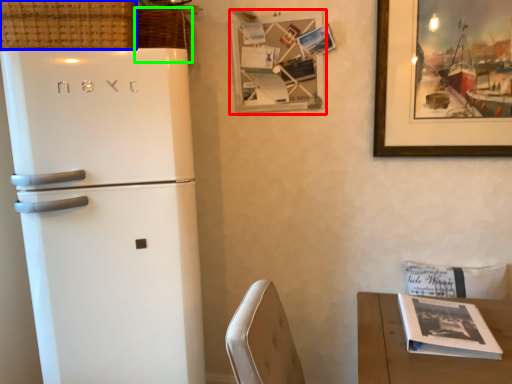
Question: Which object is the farthest from picture frame (highlighted by a red box)? Choose among these: basket (highlighted by a blue box) or basket (highlighted by a green box).

Choices:
 (A) basket
 (B) basket

Answer: (A)